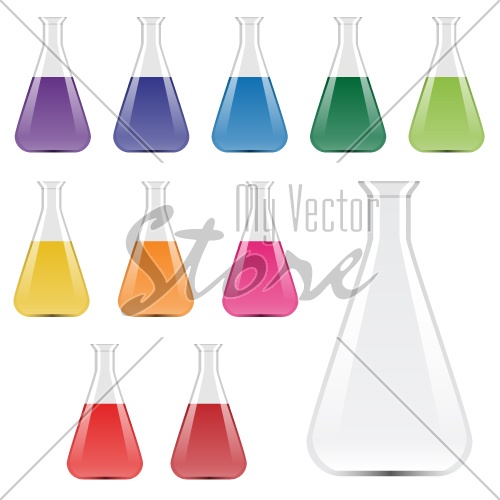
You are a GUI agent. You are given a task and a screenshot of the screen. Output one action in this format:
    pyautogui.click(x=<x>, y=<y>)
    Task: Click on the bottle
    The height and width of the screenshot is (500, 500).
    Given the screenshot: What is the action you would take?
    pyautogui.click(x=387, y=311)